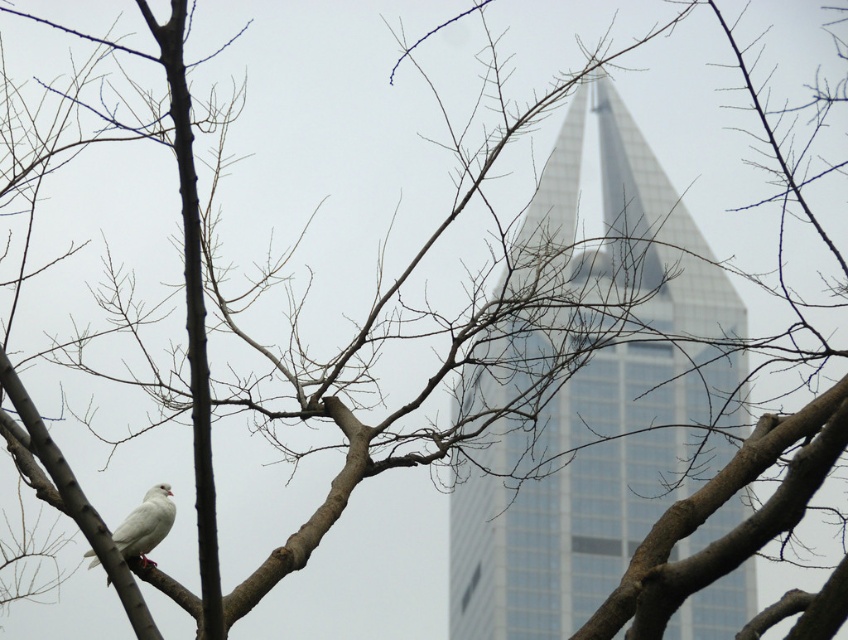
You are an ornithologist observing the brown rough tree branch at center and the white matte bird at lower left. Which object is nearer to your position as an observer?

The brown rough tree branch at center is closer to the viewer than the white matte bird at lower left, so the brown rough tree branch at center is nearer to your position as an observer.

You are a photographer standing at the base of the glassy silver tower at center. You want to capture a photo of the white bird perched on the tree branch in the foreground while ensuring the tower is still visible in the background. Given that the tower is 86.56 feet away from you, what is the minimum distance you need to move backward to include both the bird and the tower in your shot?

The glassy silver tower at center is 86.56 feet away from the camera. To include both the bird and the tower in the shot, you need to move backward until the bird is within the camera frame while maintaining the tower in the background. The exact distance depends on the camera lens and field of view, but moving back approximately 100 feet might achieve this balance.

You are an architect designing a new park. You want to place a statue of the white bird from the image on a pedestal so that it appears to be perched on the brown rough tree branch at center. However, the statue must also be visible from the glassy silver tower at center. Is this possible given their positions?

Yes, because the glassy silver tower at center is above the brown rough tree branch at center, placing the statue on the branch would allow it to be seen from the tower.